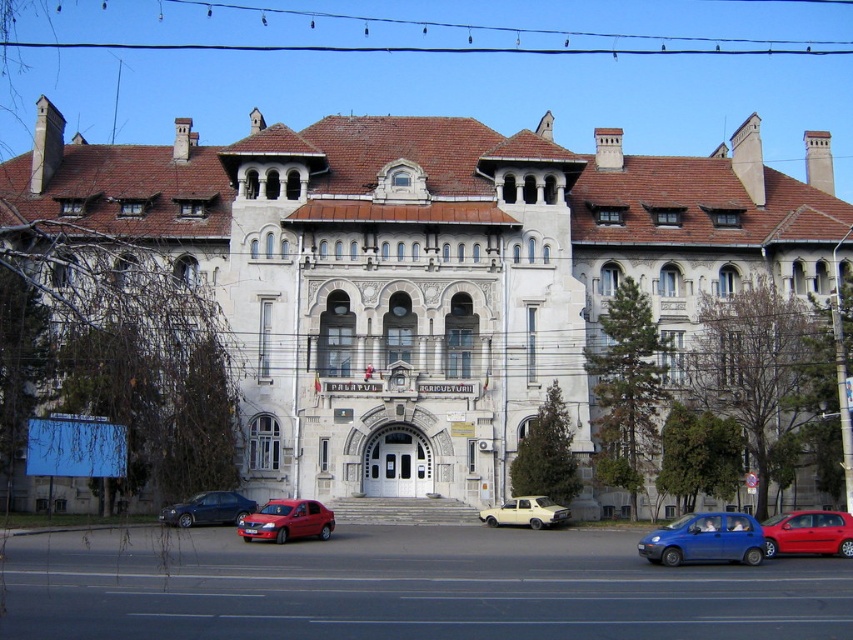
Question: Which object is positioned farthest from the metallic red car at center?

Choices:
 (A) metallic blue sedan at lower center
 (B) white stone building at center
 (C) blue matte hatchback at lower right

Answer: (B)

Question: Which point is farther to the camera?

Choices:
 (A) metallic red car at center
 (B) metallic blue sedan at lower center

Answer: (B)

Question: Where is white stone building at center located in relation to shiny red sedan at center in the image?

Choices:
 (A) below
 (B) above

Answer: (B)

Question: In this image, where is white stone building at center located relative to metallic red car at center?

Choices:
 (A) above
 (B) below

Answer: (A)

Question: Based on their relative distances, which object is farther from the metallic blue sedan at lower center?

Choices:
 (A) blue matte hatchback at lower right
 (B) matte yellow car at center

Answer: (A)

Question: Does white stone building at center appear on the left side of metallic red car at center?

Choices:
 (A) no
 (B) yes

Answer: (B)